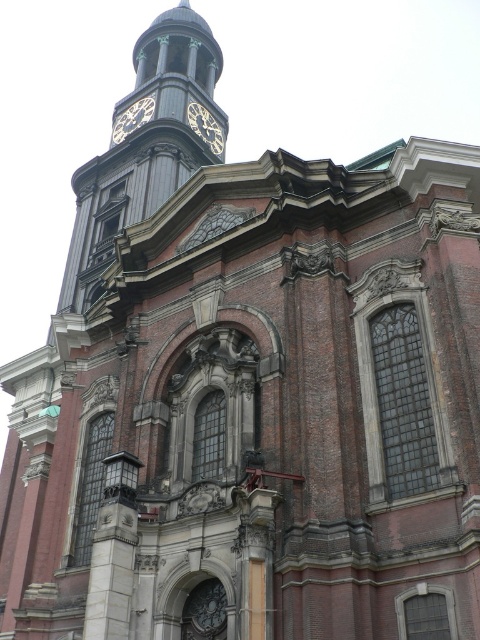
Question: Estimate the real-world distances between objects in this image. Which object is farther from the gold metallic clock at upper left?

Choices:
 (A) polished brass clock tower at upper center
 (B) gold metallic clock at upper center

Answer: (A)

Question: Can you confirm if polished brass clock tower at upper center is wider than gold metallic clock at upper left?

Choices:
 (A) no
 (B) yes

Answer: (B)

Question: Is gold metallic clock at upper left wider than gold metallic clock at upper center?

Choices:
 (A) yes
 (B) no

Answer: (A)

Question: Is polished brass clock tower at upper center above gold metallic clock at upper left?

Choices:
 (A) yes
 (B) no

Answer: (A)

Question: Estimate the real-world distances between objects in this image. Which object is farther from the polished brass clock tower at upper center?

Choices:
 (A) gold metallic clock at upper center
 (B) gold metallic clock at upper left

Answer: (A)

Question: Considering the real-world distances, which object is farthest from the gold metallic clock at upper center?

Choices:
 (A) polished brass clock tower at upper center
 (B) gold metallic clock at upper left

Answer: (A)